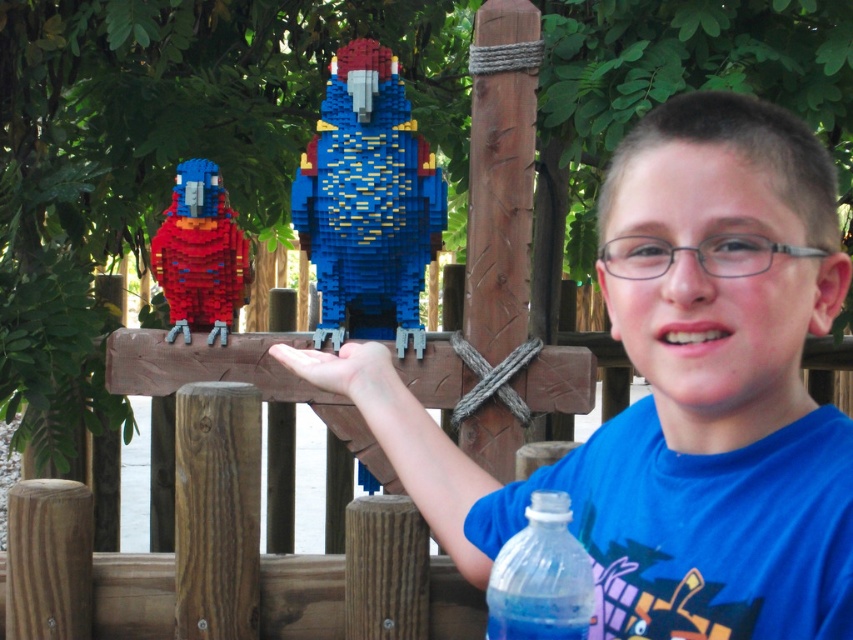
You are a photographer adjusting your camera settings to focus on two specific points in the scene. The first point is at coordinates point (474, 573) and the second is at point (339, 232). Which point should you focus on first if you want to capture the closest object to the camera?

Point (474, 573) is closer to the camera than point (339, 232), so you should focus on point (474, 573) first to capture the closest object.